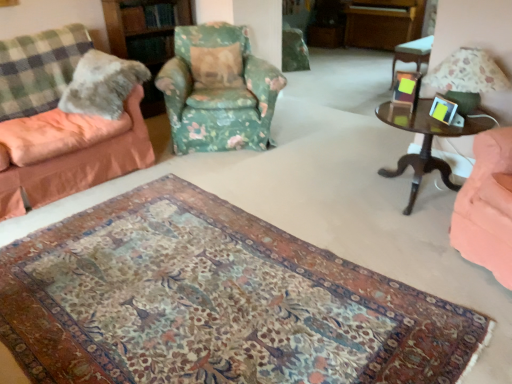
Question: Is dark wood side table at right, which is the first table in left-to-right order, facing away from fluffy fabric couch at left, which ranks as the second chair in right-to-left order?

Choices:
 (A) yes
 (B) no

Answer: (B)

Question: Is fluffy fabric couch at left, the first chair from the left, located within dark wood side table at right, the 2th table from the back?

Choices:
 (A) no
 (B) yes

Answer: (A)

Question: Is dark wood side table at right, which is the second table in right-to-left order, further to camera compared to fluffy fabric couch at left, which ranks as the second chair in right-to-left order?

Choices:
 (A) no
 (B) yes

Answer: (B)

Question: Can you confirm if dark wood side table at right, the 1th table in the bottom-to-top sequence, is bigger than fluffy fabric couch at left, the first chair from the left?

Choices:
 (A) no
 (B) yes

Answer: (A)

Question: Is dark wood side table at right, the 2th table from the back, facing towards fluffy fabric couch at left, the first chair from the left?

Choices:
 (A) no
 (B) yes

Answer: (A)

Question: In terms of height, does floral fabric armchair at center, marked as the 1th chair in a right-to-left arrangement, look taller or shorter compared to fuzzy fabric pillow at left, which is the second pillow in right-to-left order?

Choices:
 (A) short
 (B) tall

Answer: (B)

Question: From a real-world perspective, is floral fabric armchair at center, marked as the 1th chair in a right-to-left arrangement, above or below fuzzy fabric pillow at left, which ranks as the first pillow in front-to-back order?

Choices:
 (A) below
 (B) above

Answer: (A)

Question: Is floral fabric armchair at center, marked as the 2th chair in a left-to-right arrangement, wider or thinner than fuzzy fabric pillow at left, which is the second pillow in right-to-left order?

Choices:
 (A) wide
 (B) thin

Answer: (A)

Question: In terms of size, does floral fabric armchair at center, marked as the 2th chair in a left-to-right arrangement, appear bigger or smaller than fuzzy fabric pillow at left, the second pillow from the back?

Choices:
 (A) small
 (B) big

Answer: (B)

Question: Considering the positions of metallic silver picture frame at right, which ranks as the second picture frame in back-to-front order, and dark wood side table at right, the 1th table when ordered from front to back, in the image, is metallic silver picture frame at right, which ranks as the second picture frame in back-to-front order, bigger or smaller than dark wood side table at right, the 1th table when ordered from front to back,?

Choices:
 (A) big
 (B) small

Answer: (B)

Question: Relative to dark wood side table at right, the 2th table from the back, is metallic silver picture frame at right, which ranks as the second picture frame in back-to-front order, in front or behind?

Choices:
 (A) behind
 (B) front

Answer: (A)

Question: From the image's perspective, relative to dark wood side table at right, the 1th table in the bottom-to-top sequence, is metallic silver picture frame at right, which ranks as the second picture frame in back-to-front order, above or below?

Choices:
 (A) below
 (B) above

Answer: (B)

Question: Considering the relative positions of metallic silver picture frame at right, which is the first picture frame in front-to-back order, and dark wood side table at right, the 1th table when ordered from front to back, in the image provided, is metallic silver picture frame at right, which is the first picture frame in front-to-back order, to the left or to the right of dark wood side table at right, the 1th table when ordered from front to back,?

Choices:
 (A) left
 (B) right

Answer: (A)

Question: Based on their positions, is metallic silver picture frame at upper right, which appears as the second picture frame when viewed from the front, located to the left or right of green checkered blanket at left?

Choices:
 (A) left
 (B) right

Answer: (B)

Question: In terms of height, does metallic silver picture frame at upper right, the 1th picture frame viewed from the back, look taller or shorter compared to green checkered blanket at left?

Choices:
 (A) short
 (B) tall

Answer: (A)